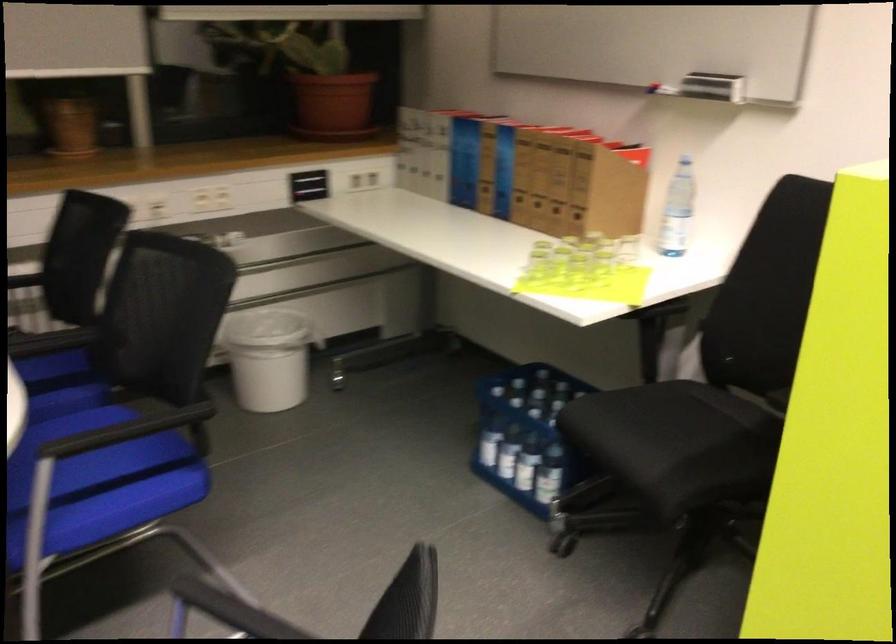
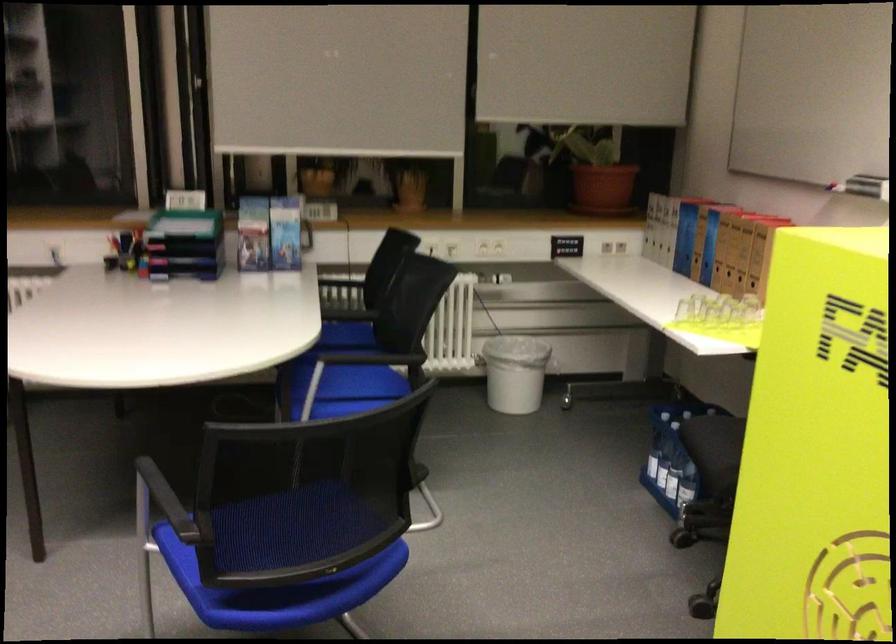
Where in the second image is the point corresponding to [279,363] from the first image?

(514, 373)